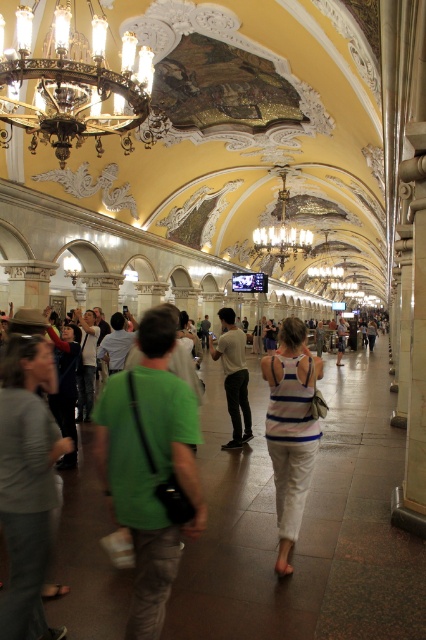
Question: Is gray cotton shirt at center closer to the viewer compared to green cotton shirt at center?

Choices:
 (A) no
 (B) yes

Answer: (B)

Question: Can you confirm if gray cotton shirt at center is positioned to the right of white cotton shirt at center?

Choices:
 (A) no
 (B) yes

Answer: (A)

Question: Which object is the closest to the gold metallic chandelier at center?

Choices:
 (A) gold ornate chandelier at upper left
 (B) green cotton shirt at center
 (C) green fabric shirt at center

Answer: (B)

Question: Which of the following is the closest to the observer?

Choices:
 (A) (235, 445)
 (B) (86, 321)
 (C) (8, 140)

Answer: (A)

Question: Can you confirm if gold ornate chandelier at upper left is positioned above gold metallic chandelier at center?

Choices:
 (A) yes
 (B) no

Answer: (B)

Question: Which of the following is the farthest from the observer?

Choices:
 (A) (94, 358)
 (B) (233, 358)
 (C) (68, 33)
 (D) (31, 493)

Answer: (A)